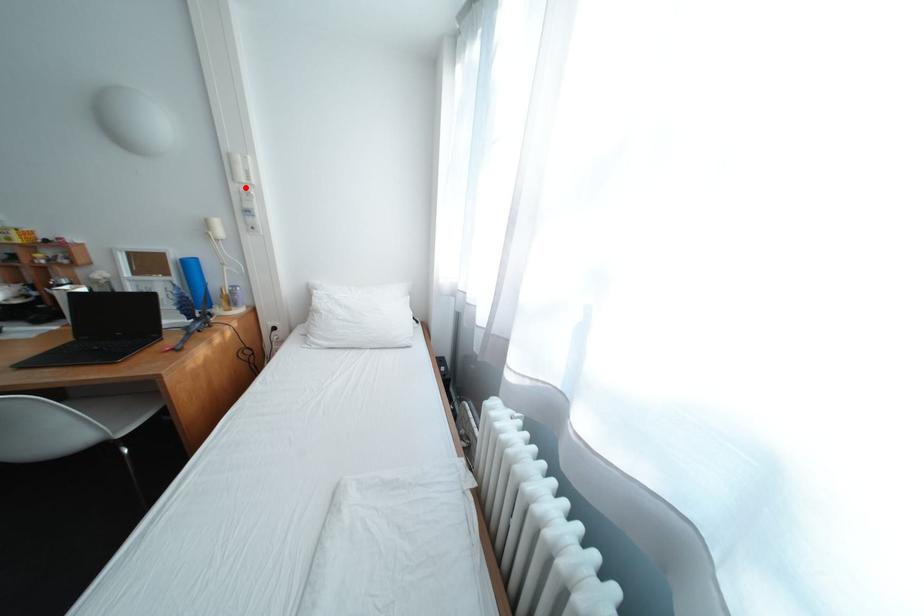
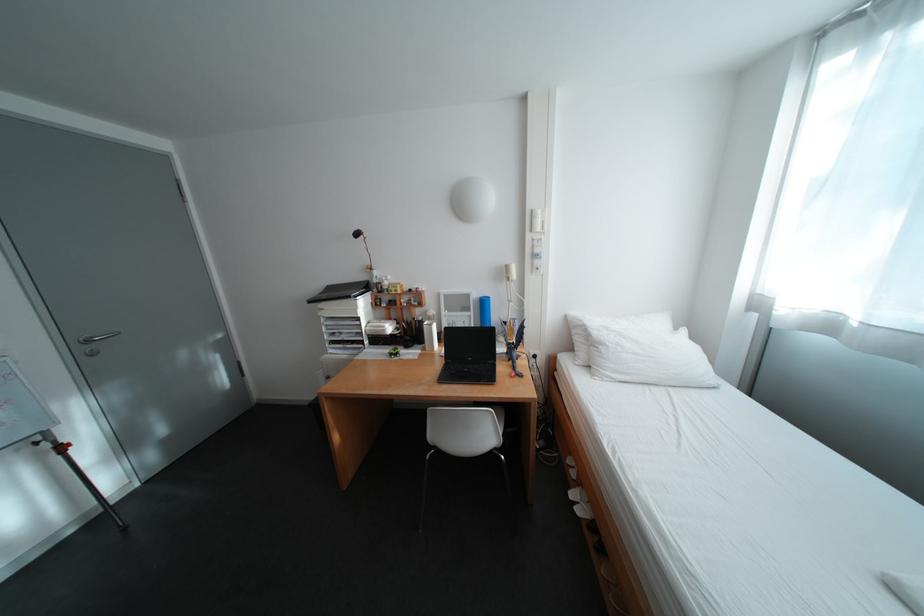
Locate, in the second image, the point that corresponds to the highlighted location in the first image.

(541, 237)